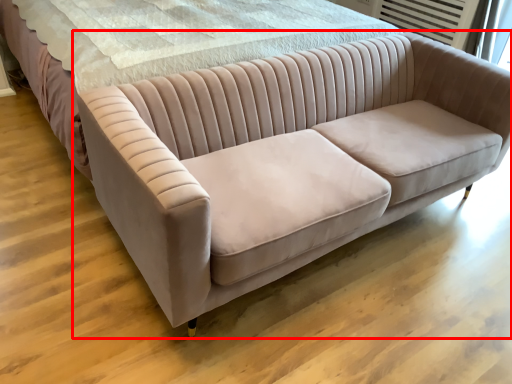
Question: In this image, where is studio couch (annotated by the red box) located relative to bed?

Choices:
 (A) right
 (B) left

Answer: (A)